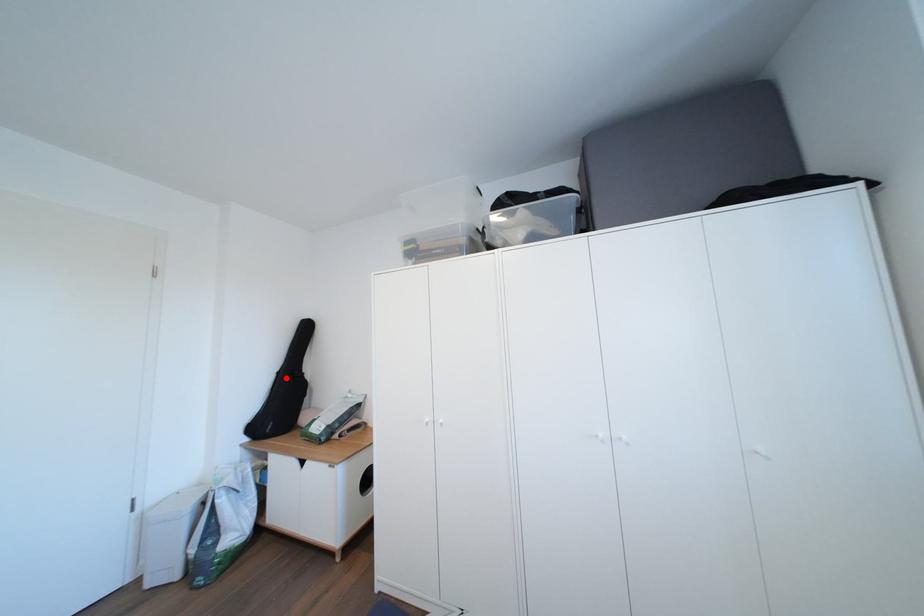
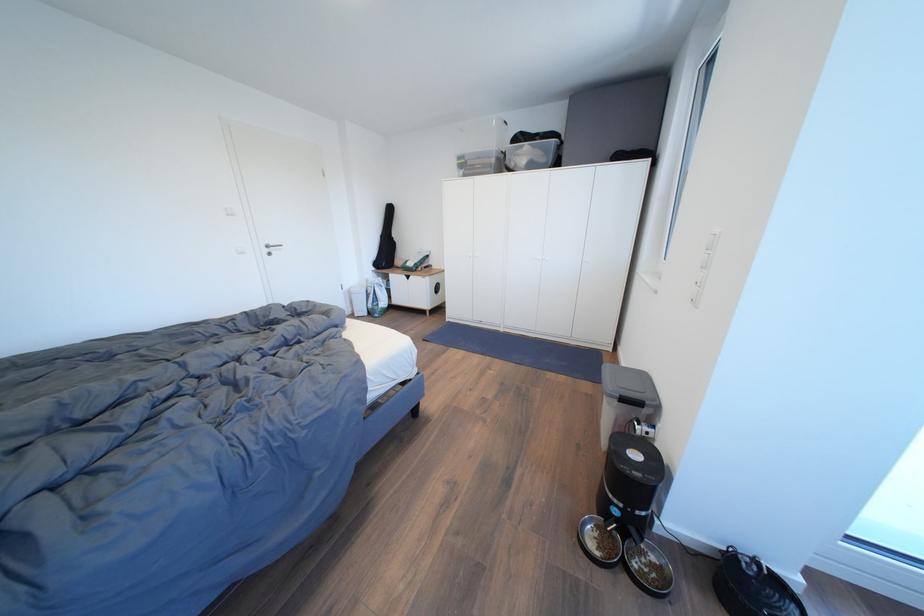
The point at the highlighted location is marked in the first image. Where is the corresponding point in the second image?

(388, 241)